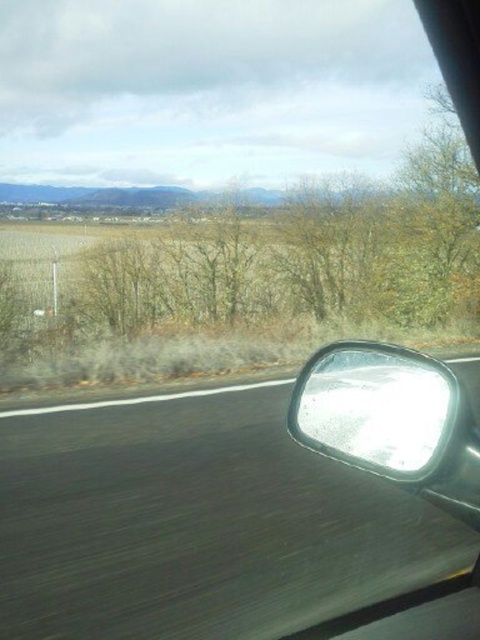
Can you confirm if brown leafless tree at center is wider than glossy metallic rearview mirror at lower right?

Indeed, brown leafless tree at center has a greater width compared to glossy metallic rearview mirror at lower right.

Is brown leafless tree at center in front of glossy metallic rearview mirror at lower right?

No, brown leafless tree at center is further to the viewer.

Between point (277, 308) and point (355, 436), which one is positioned behind?

Point (277, 308)

This screenshot has height=640, width=480. Find the location of `brown leafless tree at center`. brown leafless tree at center is located at coordinates (264, 253).